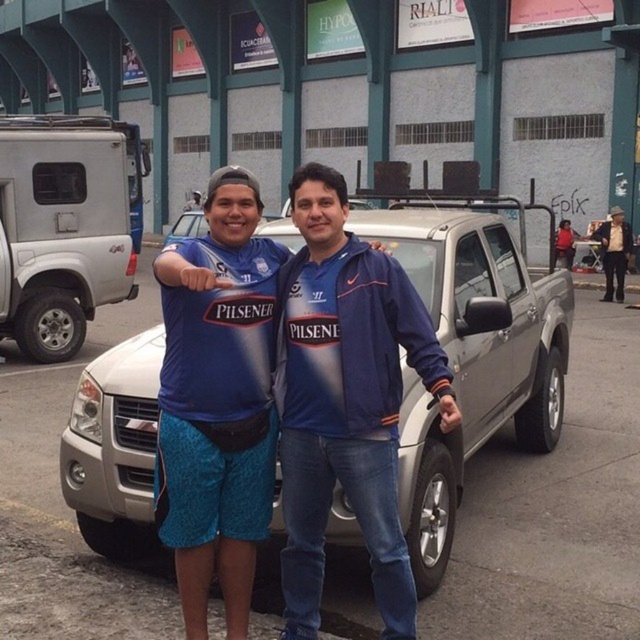
You are a photographer setting up a shoot in this scene. You want to ensure that both the satin silver truck at center and the blue fabric jacket at center are visible in the frame. Based on their positions, which object should you focus on first to capture both in the shot?

The satin silver truck at center is located above the blue fabric jacket at center, so focusing on the truck first will help ensure both are in the frame as the jacket is positioned below it.

You are a delivery driver who needs to park your satin silver truck at center in a parking spot that is exactly the width of the blue fabric jacket at center. Will the truck fit in the parking spot?

The satin silver truck at center might be wider than blue fabric jacket at center, so it may not fit in the parking spot designed for the jacket width.

You are a photographer trying to capture a clear shot of both the blue fabric jacket at center and the silver metallic suv at left. Based on their positions, which object should you focus on first to ensure both are in focus?

Since the blue fabric jacket at center is closer to the viewer than the silver metallic suv at left, you should focus on the silver metallic suv at left first. This is because focusing on the farther object allows the depth of field to naturally cover the closer object as well, increasing the likelihood both will be in focus.